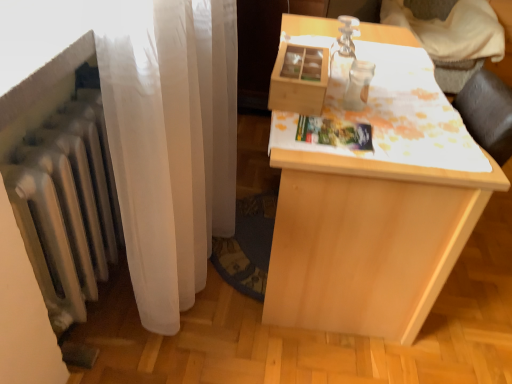
What do you see at coordinates (367, 240) in the screenshot? I see `light wood table at center` at bounding box center [367, 240].

Describe the element at coordinates (450, 35) in the screenshot. The width and height of the screenshot is (512, 384). I see `wooden table at upper right` at that location.

Measure the distance between white sheer curtain at left and camera.

white sheer curtain at left and camera are 22.87 inches apart from each other.

Image resolution: width=512 pixels, height=384 pixels. What are the coordinates of `light wood table at center` in the screenshot? It's located at (367, 240).

Does wooden table at upper right have a smaller size compared to white sheer curtain at left?

No, wooden table at upper right is not smaller than white sheer curtain at left.

Based on their positions, is wooden table at upper right located to the left or right of white sheer curtain at left?

Based on their positions, wooden table at upper right is located to the right of white sheer curtain at left.

Does wooden table at upper right lie behind white sheer curtain at left?

Yes, it is behind white sheer curtain at left.

Considering the positions of point (417, 7) and point (144, 298), is point (417, 7) closer or farther from the camera than point (144, 298)?

Clearly, point (417, 7) is more distant from the camera than point (144, 298).

Identify the location of curtain above the light wood table at center (from a real-world perspective). (135, 159).

Who is shorter, light wood table at center or white sheer curtain at left?

white sheer curtain at left.

Would you say light wood table at center is outside white sheer curtain at left?

Yes.

From the picture: Considering the relative sizes of wooden table at upper right and light wood table at center in the image provided, is wooden table at upper right shorter than light wood table at center?

Incorrect, the height of wooden table at upper right does not fall short of that of light wood table at center.

Is wooden table at upper right located outside light wood table at center?

wooden table at upper right is positioned outside light wood table at center.

How different are the orientations of wooden table at upper right and light wood table at center in degrees?

There is a 91.8-degree angle between the facing directions of wooden table at upper right and light wood table at center.

Between wooden table at upper right and light wood table at center, which one appears on the right side from the viewer's perspective?

wooden table at upper right.

From the image's perspective, is light wood table at center above or below wooden table at upper right?

light wood table at center is situated lower than wooden table at upper right in the image.

Could you tell me if light wood table at center is facing wooden table at upper right?

No, light wood table at center is not turned towards wooden table at upper right.

Locate an element on the screen. furniture that is on the right side of light wood table at center is located at coordinates (450, 35).

Identify the location of table lying below the white sheer curtain at left (from the image's perspective). The image size is (512, 384). (367, 240).

From their relative heights in the image, would you say white sheer curtain at left is taller or shorter than light wood table at center?

In the image, white sheer curtain at left appears to be shorter than light wood table at center.

Does white sheer curtain at left turn towards light wood table at center?

Yes, white sheer curtain at left is oriented towards light wood table at center.

Based on the photo, considering the relative sizes of white sheer curtain at left and light wood table at center in the image provided, is white sheer curtain at left smaller than light wood table at center?

Yes.

Is white sheer curtain at left oriented towards wooden table at upper right?

No.

Which is more to the right, white sheer curtain at left or wooden table at upper right?

From the viewer's perspective, wooden table at upper right appears more on the right side.

Looking at this image, from a real-world perspective, does white sheer curtain at left stand above wooden table at upper right?

Correct, in the physical world, white sheer curtain at left is higher than wooden table at upper right.

At what (x,y) coordinates should I click in order to perform the action: click on furniture that is under the white sheer curtain at left (from a real-world perspective). Please return your answer as a coordinate pair (x, y). The width and height of the screenshot is (512, 384). Looking at the image, I should click on (450, 35).

Where is `table lying on the right of white sheer curtain at left`? table lying on the right of white sheer curtain at left is located at coordinates (367, 240).

When comparing their distances from light wood table at center, does white sheer curtain at left or wooden table at upper right seem further?

wooden table at upper right lies further to light wood table at center than the other object.

Considering their positions, is white sheer curtain at left positioned closer to wooden table at upper right than light wood table at center?

light wood table at center.

When comparing their distances from white sheer curtain at left, does light wood table at center or wooden table at upper right seem further?

Among the two, wooden table at upper right is located further to white sheer curtain at left.

When comparing their distances from wooden table at upper right, does light wood table at center or white sheer curtain at left seem further?

white sheer curtain at left lies further to wooden table at upper right than the other object.

Estimate the real-world distances between objects in this image. Which object is closer to light wood table at center, wooden table at upper right or white sheer curtain at left?

The object closer to light wood table at center is white sheer curtain at left.

Which object lies nearer to the anchor point white sheer curtain at left, wooden table at upper right or light wood table at center?

light wood table at center is closer to white sheer curtain at left.

The image size is (512, 384). Find the location of `table positioned between white sheer curtain at left and wooden table at upper right from near to far`. table positioned between white sheer curtain at left and wooden table at upper right from near to far is located at coordinates (367, 240).